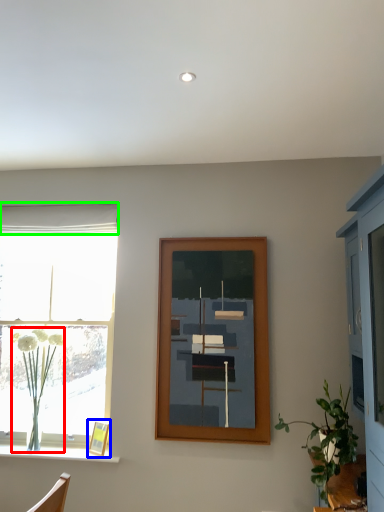
Question: Based on their relative distances, which object is farther from plant (highlighted by a red box)? Choose from picture frame (highlighted by a blue box) and curtain (highlighted by a green box).

Choices:
 (A) picture frame
 (B) curtain

Answer: (B)